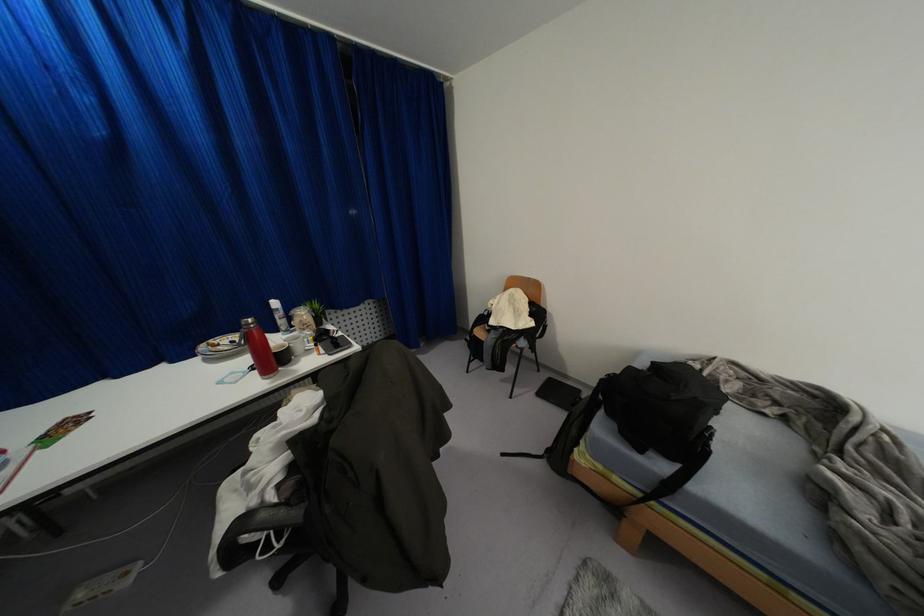
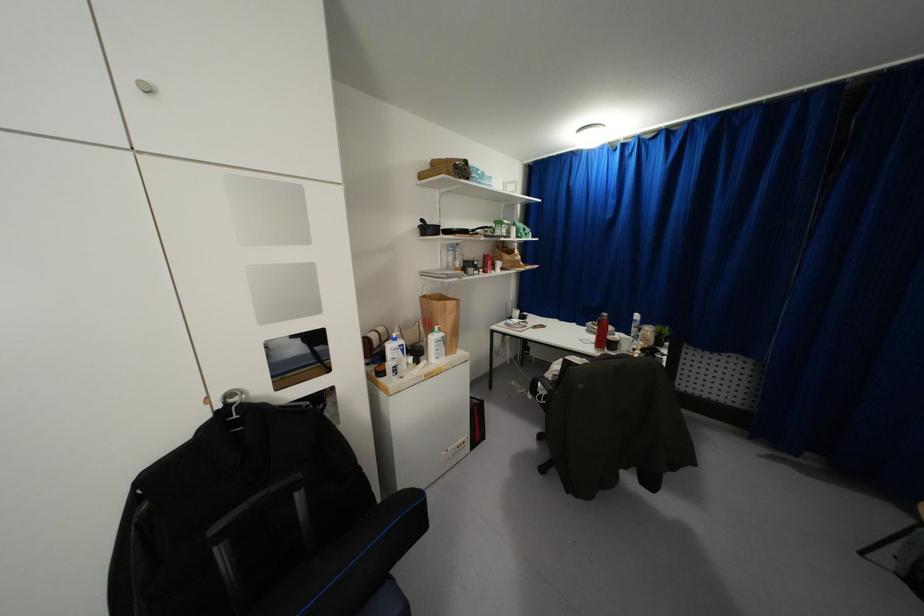
Find the pixel in the second image that matches point 249,320 in the first image.

(603, 314)